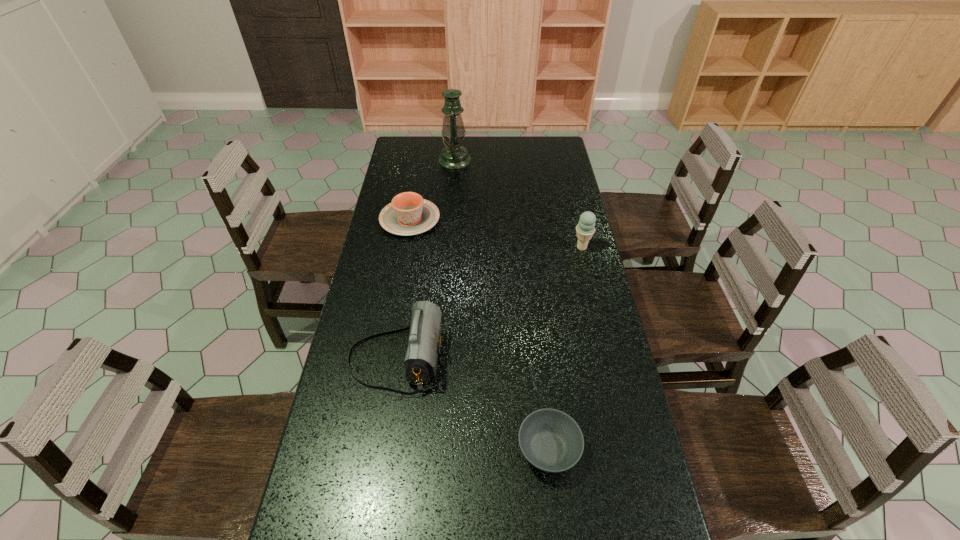
The height and width of the screenshot is (540, 960). In order to click on free space between the oil lamp and the chinaware in this screenshot , I will do `click(432, 190)`.

This screenshot has height=540, width=960. I want to click on the second closest object relative to the ice cream, so click(424, 342).

This screenshot has height=540, width=960. What are the coordinates of `the fourth closest object relative to the oil lamp` in the screenshot? It's located at (550, 440).